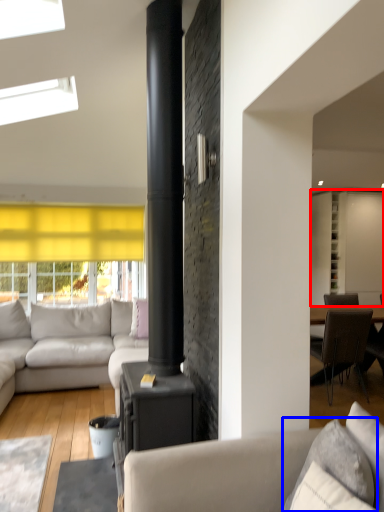
Question: Which point is further to the camera, cabinetry (highlighted by a red box) or pillow (highlighted by a blue box)?

Choices:
 (A) cabinetry
 (B) pillow

Answer: (A)